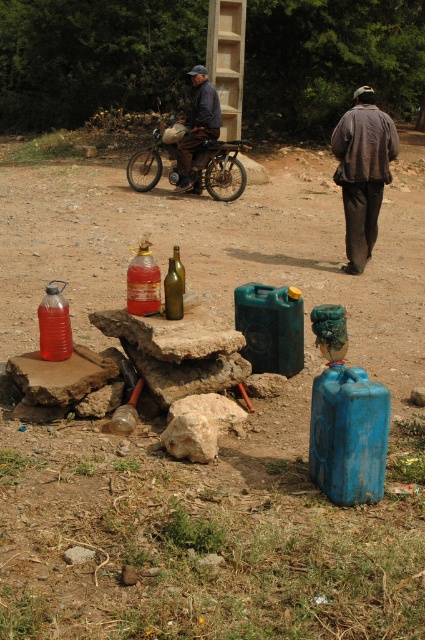
You are standing in the rural scene and want to place a small flag at each of the two points marked as point [215,132] and point [166,305]. Which point is closer to you when you are facing the scene?

Point [166,305] is closer to you because it is less further to the camera than point [215,132].

You are standing at the origin point of the coordinate system. You want to move towards the metallic silver motorcycle at center. What are the coordinates you need to move to reach it?

The coordinates to reach the metallic silver motorcycle at center are at point (218,168).

Consider the image. You are standing at the origin point of the coordinate system. Where is the metallic silver motorcycle at center located?

The metallic silver motorcycle at center is located at point (x=218, y=168).